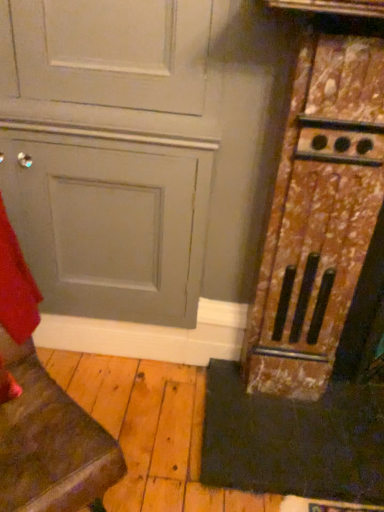
Question: Considering the relative sizes of matte gray door at lower left and matte gray door at center in the image provided, is matte gray door at lower left bigger than matte gray door at center?

Choices:
 (A) no
 (B) yes

Answer: (A)

Question: Is matte gray door at lower left shorter than matte gray door at center?

Choices:
 (A) no
 (B) yes

Answer: (B)

Question: Can you confirm if matte gray door at lower left is positioned to the right of matte gray door at center?

Choices:
 (A) yes
 (B) no

Answer: (B)

Question: Considering the relative sizes of matte gray door at lower left and matte gray door at center in the image provided, is matte gray door at lower left wider than matte gray door at center?

Choices:
 (A) yes
 (B) no

Answer: (A)

Question: Is matte gray door at lower left oriented away from matte gray door at center?

Choices:
 (A) no
 (B) yes

Answer: (A)

Question: From a real-world perspective, is matte gray door at lower left above or below matte gray door at center?

Choices:
 (A) below
 (B) above

Answer: (A)

Question: From their relative heights in the image, would you say matte gray door at lower left is taller or shorter than matte gray door at center?

Choices:
 (A) tall
 (B) short

Answer: (B)

Question: Is matte gray door at lower left inside or outside of matte gray door at center?

Choices:
 (A) inside
 (B) outside

Answer: (B)

Question: Considering the positions of matte gray door at lower left and matte gray door at center in the image, is matte gray door at lower left bigger or smaller than matte gray door at center?

Choices:
 (A) small
 (B) big

Answer: (A)

Question: Considering the positions of matte gray door at lower left and black rubber doormat at lower right in the image, is matte gray door at lower left wider or thinner than black rubber doormat at lower right?

Choices:
 (A) wide
 (B) thin

Answer: (A)

Question: Looking at the image, does matte gray door at lower left seem bigger or smaller compared to black rubber doormat at lower right?

Choices:
 (A) big
 (B) small

Answer: (A)

Question: Considering the positions of matte gray door at lower left and black rubber doormat at lower right in the image, is matte gray door at lower left taller or shorter than black rubber doormat at lower right?

Choices:
 (A) tall
 (B) short

Answer: (A)

Question: From a real-world perspective, is matte gray door at lower left positioned above or below black rubber doormat at lower right?

Choices:
 (A) above
 (B) below

Answer: (A)

Question: Is rusty wood stove at right bigger or smaller than black rubber doormat at lower right?

Choices:
 (A) big
 (B) small

Answer: (A)

Question: From their relative heights in the image, would you say rusty wood stove at right is taller or shorter than black rubber doormat at lower right?

Choices:
 (A) short
 (B) tall

Answer: (B)